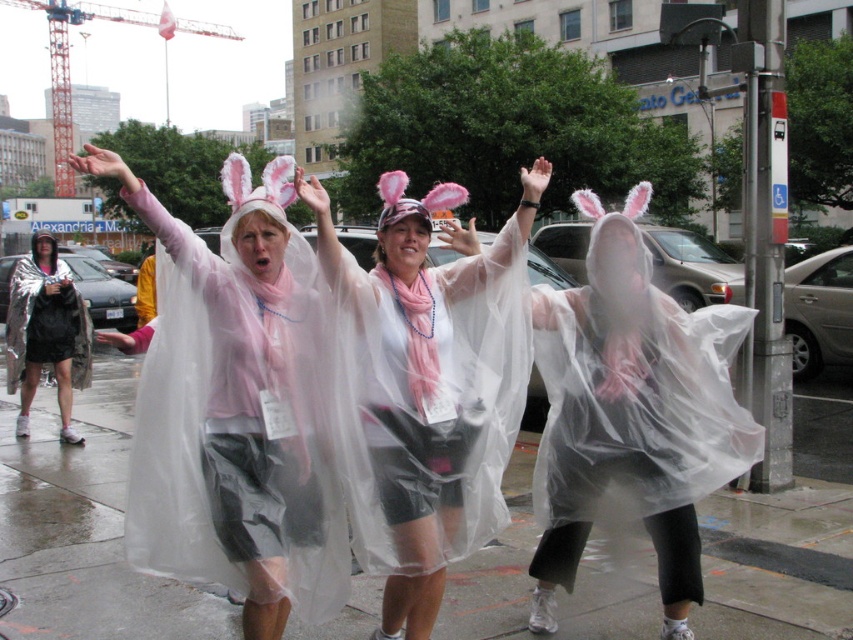
Is translucent plastic poncho at center wider than metallic silver poncho at left?

Incorrect, translucent plastic poncho at center's width does not surpass metallic silver poncho at left's.

Identify the location of translucent plastic poncho at center. (426, 388).

Locate an element on the screen. The image size is (853, 640). translucent plastic poncho at center is located at coordinates (426, 388).

Is point (641, 202) less distant than point (9, 314)?

Yes, point (641, 202) is closer to viewer.

Who is more distant from viewer, [575,433] or [50,310]?

Point [50,310]

Locate an element on the screen. The image size is (853, 640). transparent plastic raincoat at center is located at coordinates (631, 412).

Can you confirm if translucent plastic poncho at center is positioned above transparent plastic raincoat at center?

Yes, translucent plastic poncho at center is above transparent plastic raincoat at center.

Who is taller, translucent plastic poncho at center or transparent plastic raincoat at center?

translucent plastic poncho at center

Is point (399, 627) positioned after point (599, 349)?

No.

I want to click on translucent plastic poncho at center, so click(x=426, y=388).